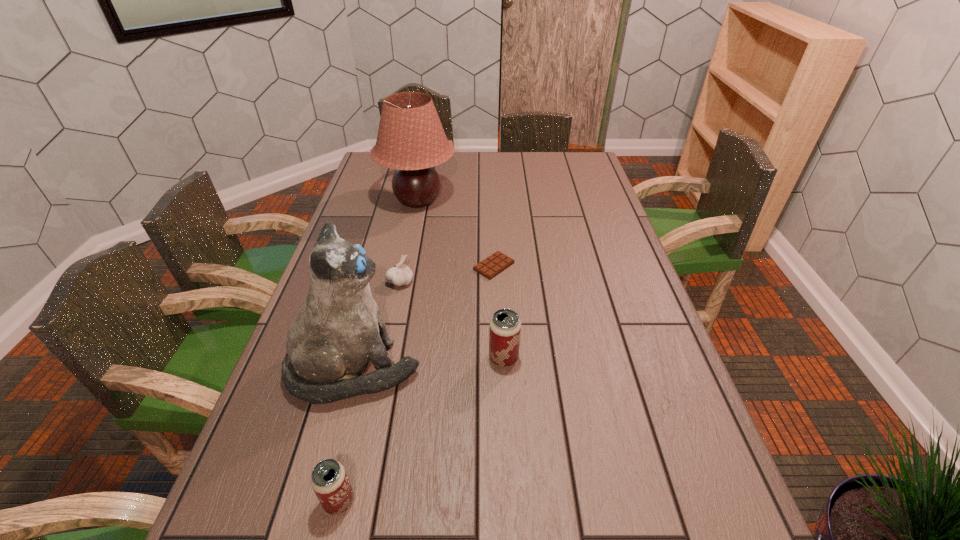
Where is `the nearest object`? the nearest object is located at coordinates (329, 480).

The width and height of the screenshot is (960, 540). In order to click on the left beer can in this screenshot , I will do `click(329, 480)`.

Find the location of a particular element. The image size is (960, 540). the third tallest object is located at coordinates (505, 326).

Identify the location of the right beer can. This screenshot has height=540, width=960. (505, 326).

In order to click on garlic in this screenshot , I will do `click(399, 275)`.

The height and width of the screenshot is (540, 960). What are the coordinates of `lampshade` in the screenshot? It's located at (411, 139).

This screenshot has height=540, width=960. In order to click on cat in this screenshot , I will do `click(340, 328)`.

Locate an element on the screen. candy bar is located at coordinates (496, 263).

At what (x,y) coordinates should I click in order to perform the action: click on vacant region located 0.110m on the back of the nearest object. Please return your answer as a coordinate pair (x, y). This screenshot has width=960, height=540. Looking at the image, I should click on (355, 432).

What are the coordinates of `vacant area situated 0.280m on the right of the right beer can` in the screenshot? It's located at (635, 358).